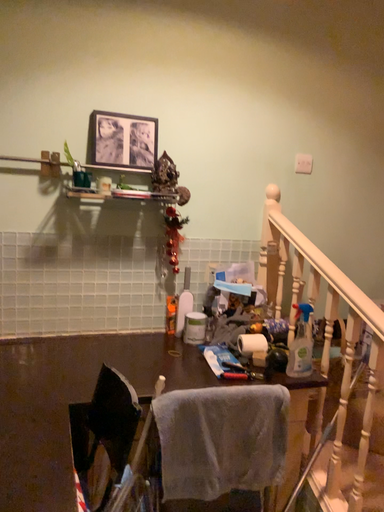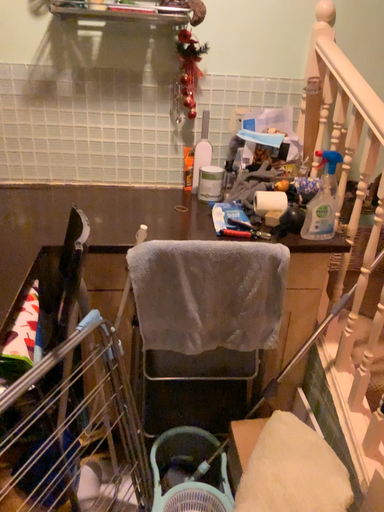
Question: Which way did the camera rotate in the video?

Choices:
 (A) rotated right
 (B) rotated left

Answer: (B)